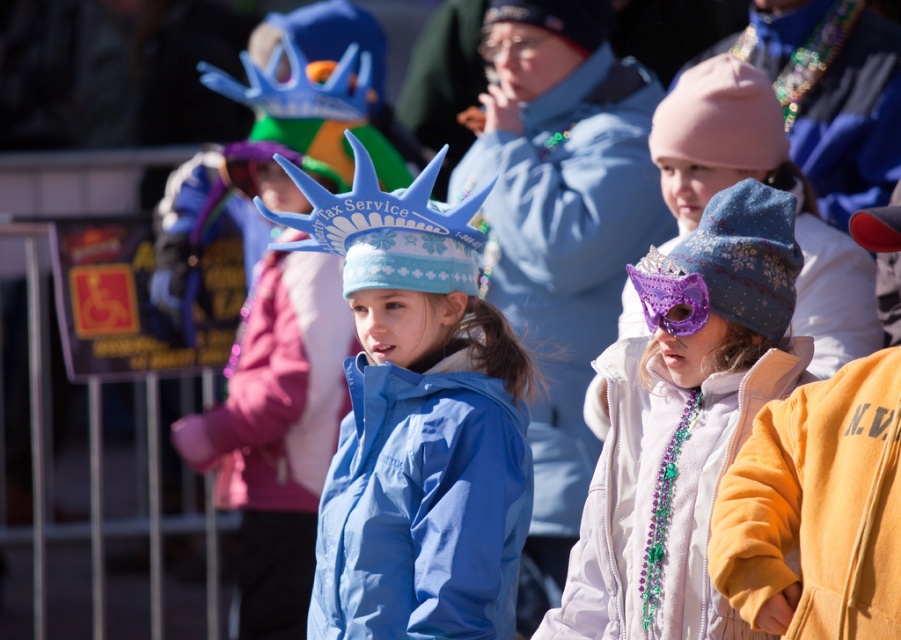
Between matte blue hat at center and white fleece jacket at center, which one appears on the right side from the viewer's perspective?

Positioned to the right is white fleece jacket at center.

Who is more distant from viewer, (x=347, y=276) or (x=733, y=417)?

The point (x=347, y=276) is more distant.

Who is more forward, (353, 406) or (617, 620)?

Point (617, 620) is more forward.

Where is `matte blue hat at center`? matte blue hat at center is located at coordinates (417, 420).

Is point (449, 528) closer to camera compared to point (787, 460)?

No, (449, 528) is behind (787, 460).

Is matte blue jacket at center above yellow fleece jacket at lower right?

No, matte blue jacket at center is not above yellow fleece jacket at lower right.

Which is in front, point (417, 547) or point (862, 365)?

Point (862, 365)

The height and width of the screenshot is (640, 901). In order to click on matte blue jacket at center in this screenshot , I will do `click(422, 506)`.

The image size is (901, 640). What do you see at coordinates (417, 420) in the screenshot? I see `matte blue hat at center` at bounding box center [417, 420].

Between matte blue hat at center and yellow fleece jacket at lower right, which one is positioned lower?

yellow fleece jacket at lower right is lower down.

Find the location of a particular element. This screenshot has width=901, height=640. matte blue hat at center is located at coordinates (417, 420).

Find the location of `matte blue hat at center`. matte blue hat at center is located at coordinates (417, 420).